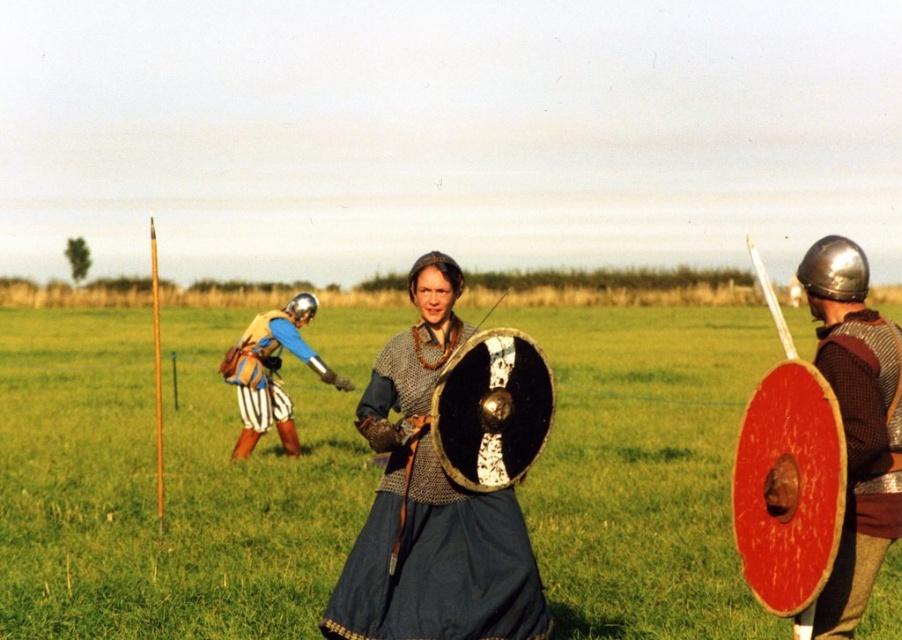
Is point (520, 497) in front of point (848, 410)?

No.

Looking at this image, can you confirm if green grass at center is positioned to the right of red wooden shield at right?

Incorrect, green grass at center is not on the right side of red wooden shield at right.

Is point (93, 424) behind point (857, 333)?

Yes.

The width and height of the screenshot is (902, 640). Find the location of `green grass at center`. green grass at center is located at coordinates (164, 486).

Between point (830, 349) and point (253, 340), which one is positioned behind?

Point (253, 340)

The height and width of the screenshot is (640, 902). Identify the location of red wooden shield at right. (856, 424).

Is chainmail armor at center below metallic blue armor at center?

Indeed, chainmail armor at center is positioned under metallic blue armor at center.

Can you confirm if chainmail armor at center is positioned above metallic blue armor at center?

Incorrect, chainmail armor at center is not positioned above metallic blue armor at center.

Is point (408, 413) less distant than point (272, 368)?

Yes, it is.

Locate an element on the screen. This screenshot has height=640, width=902. chainmail armor at center is located at coordinates (430, 524).